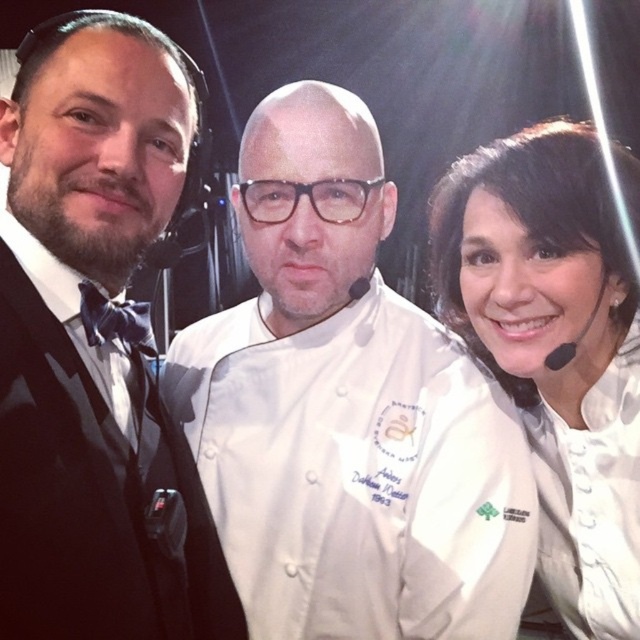
From the picture: Can you confirm if white chef coat at center is smaller than black satin bow tie at left?

Incorrect, white chef coat at center is not smaller in size than black satin bow tie at left.

Between point (291, 260) and point (65, 621), which one is positioned behind?

Point (291, 260)

Where is `white chef coat at center`? white chef coat at center is located at coordinates (346, 410).

Who is positioned more to the left, white chef coat at center or white matte chef coat at center?

white chef coat at center is more to the left.

You are a GUI agent. You are given a task and a screenshot of the screen. Output one action in this format:
    pyautogui.click(x=<x>, y=<y>)
    Task: Click on the white chef coat at center
    This screenshot has width=640, height=640.
    Given the screenshot: What is the action you would take?
    pyautogui.click(x=346, y=410)

Is point (328, 392) farther from camera compared to point (486, 300)?

No, it is not.

You are a GUI agent. You are given a task and a screenshot of the screen. Output one action in this format:
    pyautogui.click(x=<x>, y=<y>)
    Task: Click on the white chef coat at center
    
    Given the screenshot: What is the action you would take?
    pyautogui.click(x=346, y=410)

Does black satin bow tie at left have a larger size compared to white matte chef coat at center?

No, black satin bow tie at left is not bigger than white matte chef coat at center.

Between point (44, 481) and point (614, 326), which one is positioned in front?

Point (44, 481)

Who is more distant from viewer, (124, 172) or (540, 456)?

Positioned behind is point (540, 456).

Identify the location of black satin bow tie at left. (96, 346).